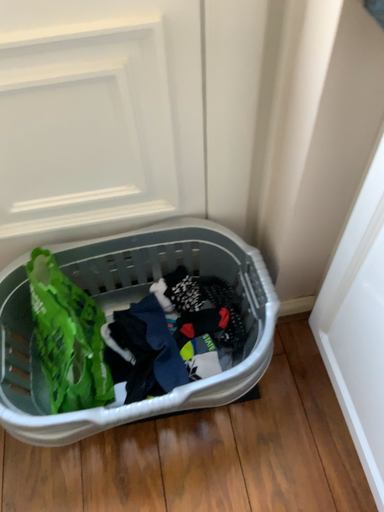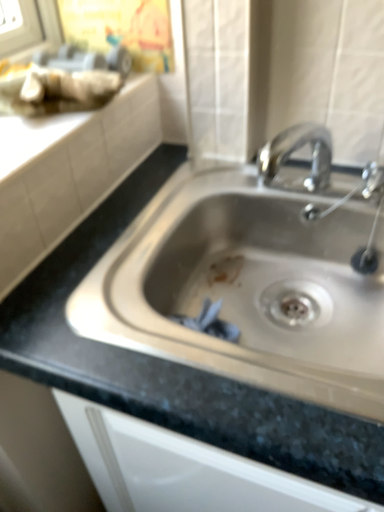
Question: How did the camera likely rotate when shooting the video?

Choices:
 (A) rotated left
 (B) rotated right

Answer: (B)